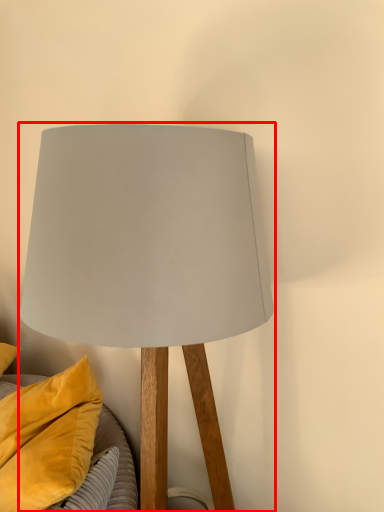
Question: Considering the relative positions of lamp (annotated by the red box) and pillow in the image provided, where is lamp (annotated by the red box) located with respect to the staircase?

Choices:
 (A) left
 (B) right

Answer: (B)